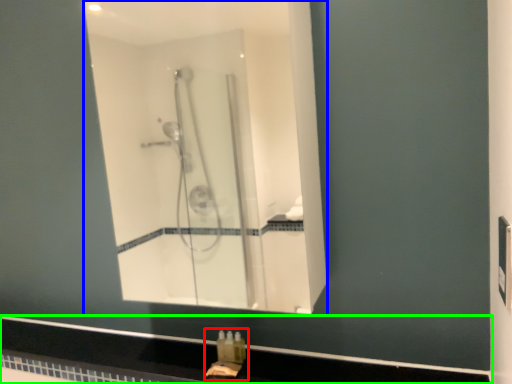
Question: Considering the real-world distances, which object is farthest from sink (highlighted by a red box)? mirror (highlighted by a blue box) or counter top (highlighted by a green box)?

Choices:
 (A) mirror
 (B) counter top

Answer: (A)